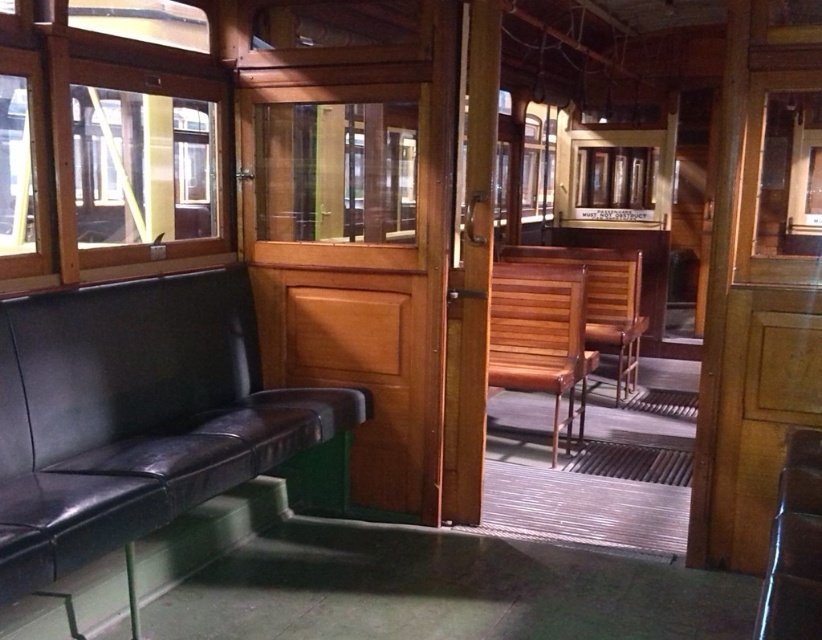
You are standing inside the vintage tram and want to determine the relative positions of two points marked in the image. Which point is closer to you, point [19,426] or point [499,321]?

Point [19,426] is closer to the camera than point [499,321].

You are a passenger in the vintage tram and need to sit down. You see a wooden chair at center and a metallic silver chair at center. Which chair is taller?

The wooden chair at center is much taller than the metallic silver chair at center.

You are standing at the point marked by the coordinates point (135,417) in the vintage tram interior. Which object are you closest to?

The point (135,417) corresponds to the black leather couch at left, so you are closest to the black leather couch at left.